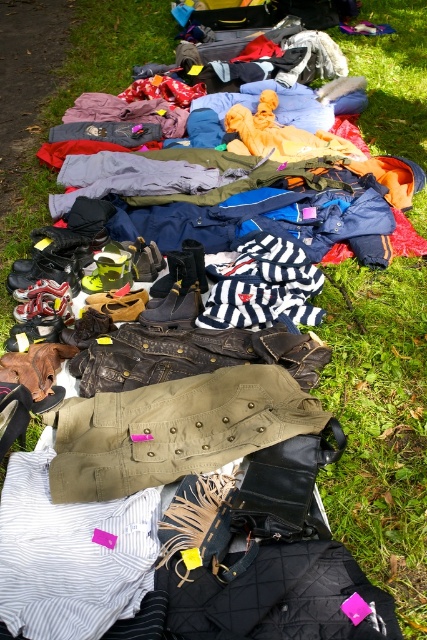
Can you confirm if khaki cotton jacket at center is wider than striped cotton shirt at center?

Correct, the width of khaki cotton jacket at center exceeds that of striped cotton shirt at center.

Between point (102, 465) and point (105, 525), which one is positioned behind?

Point (102, 465)

The image size is (427, 640). I want to click on khaki cotton jacket at center, so click(x=173, y=429).